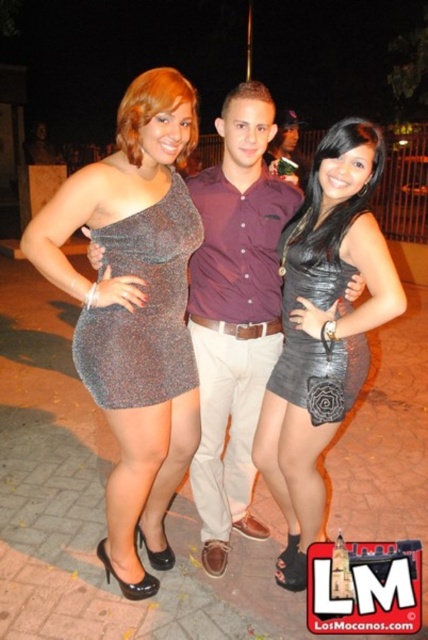
Is sparkly metallic dress at center above black leather dress at center?

Incorrect, sparkly metallic dress at center is not positioned above black leather dress at center.

Looking at this image, who is higher up, sparkly metallic dress at center or black leather dress at center?

black leather dress at center

Between point (119, 209) and point (220, 109), which one is positioned behind?

The point (220, 109) is more distant.

Identify the location of sparkly metallic dress at center. This screenshot has width=428, height=640. (134, 310).

Does sparkly metallic dress at center come in front of leather-like black dress at center?

Yes, it is.

Does sparkly metallic dress at center have a larger size compared to leather-like black dress at center?

Yes.

The width and height of the screenshot is (428, 640). Describe the element at coordinates (134, 310) in the screenshot. I see `sparkly metallic dress at center` at that location.

At what (x,y) coordinates should I click in order to perform the action: click on sparkly metallic dress at center. Please return your answer as a coordinate pair (x, y). This screenshot has width=428, height=640. Looking at the image, I should click on (134, 310).

Between leather skirt at center and leather-like black dress at center, which one has more height?

leather skirt at center

Consider the image. Is leather skirt at center wider than leather-like black dress at center?

Yes, leather skirt at center is wider than leather-like black dress at center.

Image resolution: width=428 pixels, height=640 pixels. In order to click on leather skirt at center in this screenshot , I will do `click(323, 330)`.